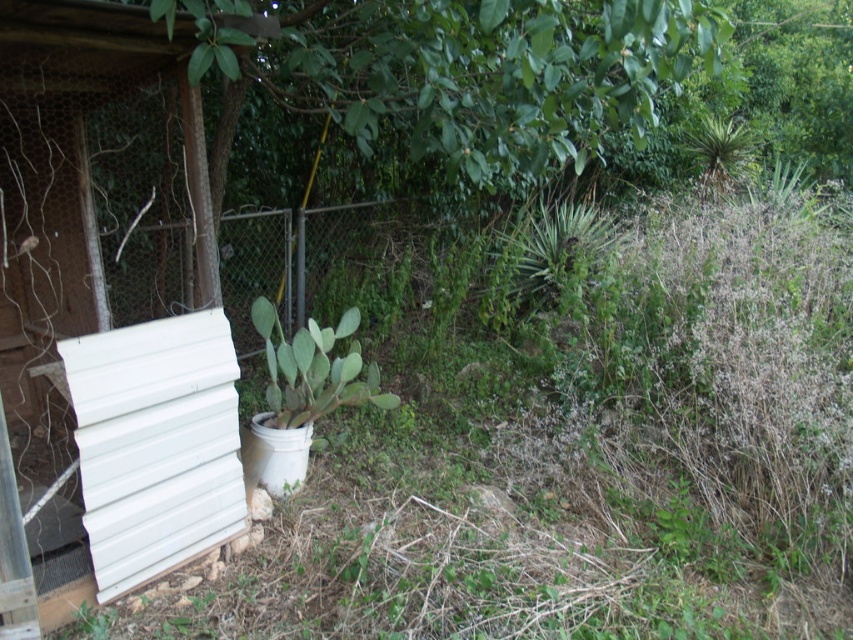
Question: Is white corrugated metal hut at left to the right of metallic chain-link fence at center from the viewer's perspective?

Choices:
 (A) no
 (B) yes

Answer: (A)

Question: Does white corrugated metal hut at left appear over metallic chain-link fence at center?

Choices:
 (A) no
 (B) yes

Answer: (A)

Question: Among these points, which one is nearest to the camera?

Choices:
 (A) (22, 404)
 (B) (297, 300)

Answer: (A)

Question: Does white corrugated metal hut at left appear over metallic chain-link fence at center?

Choices:
 (A) yes
 (B) no

Answer: (B)

Question: Which point is closer to the camera?

Choices:
 (A) white corrugated metal hut at left
 (B) metallic chain-link fence at center

Answer: (A)

Question: Which of the following is the closest to the observer?

Choices:
 (A) metallic chain-link fence at center
 (B) white corrugated metal hut at left

Answer: (B)